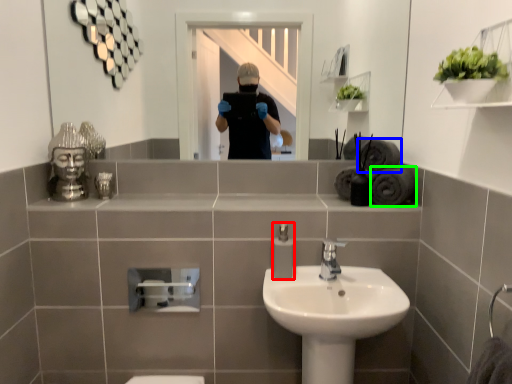
Question: Based on their relative distances, which object is nearer to soap dispenser (highlighted by a red box)? Choose from bath towel (highlighted by a blue box) and bath towel (highlighted by a green box).

Choices:
 (A) bath towel
 (B) bath towel

Answer: (B)